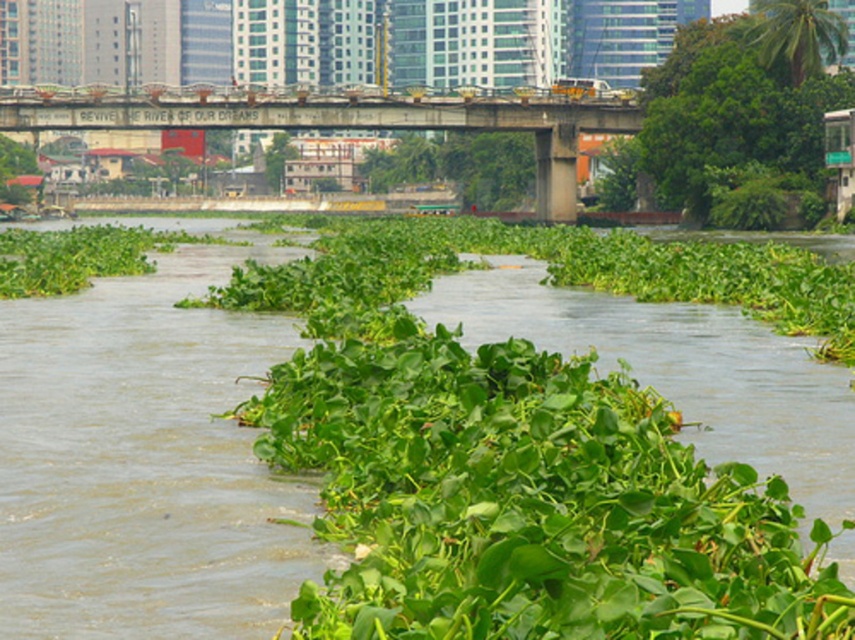
You are a botanist studying the river ecosystem. You observe the green leafy vegetation at center and the green leafy plant at upper right. Which of these two has a larger size?

The green leafy plant at upper right is larger in size compared to the green leafy vegetation at center.